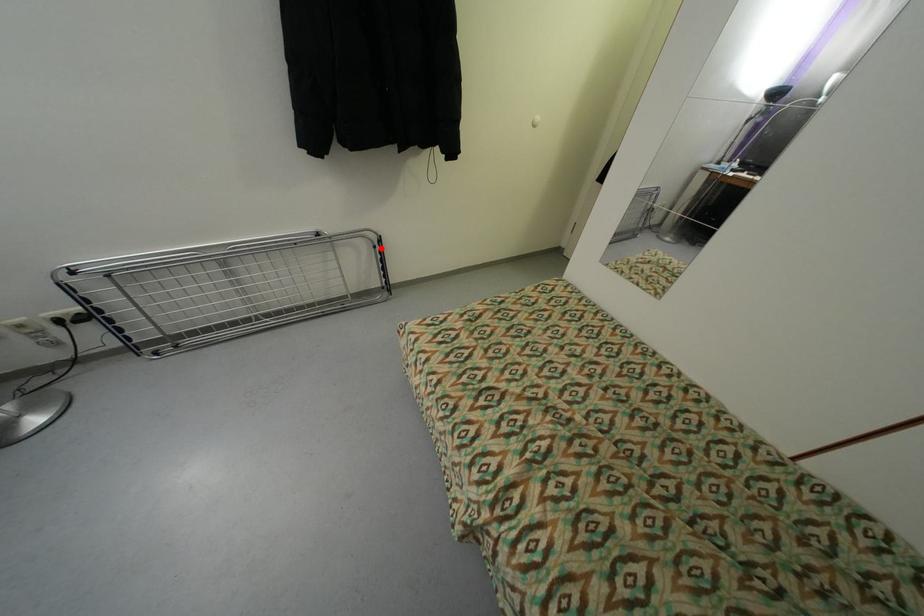
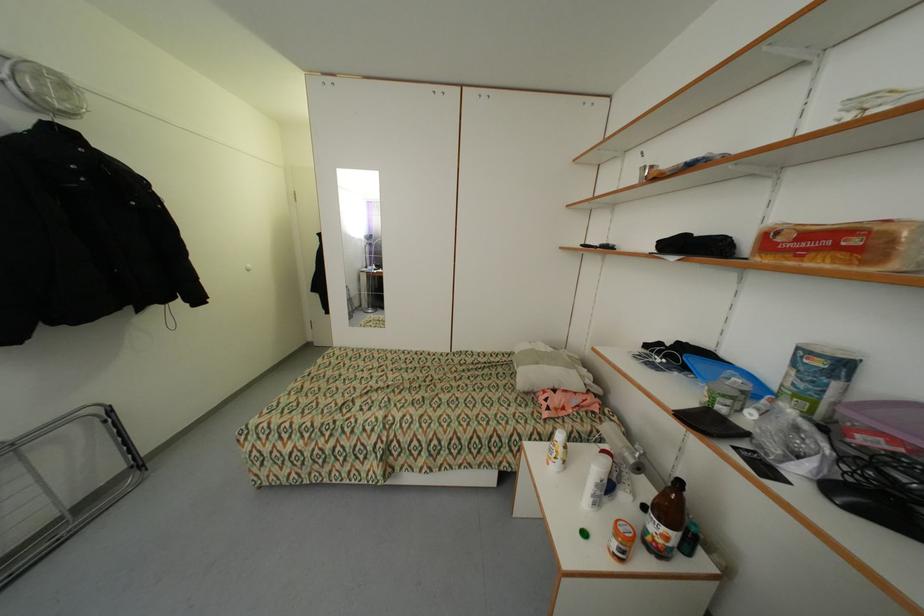
Question: I am providing you with two images of the same scene from different viewpoints. Image1 has a red point marked. In image2, the corresponding 3D location appears at what relative position? Reply with the corresponding letter.

Choices:
 (A) Closer
 (B) Farther

Answer: (B)